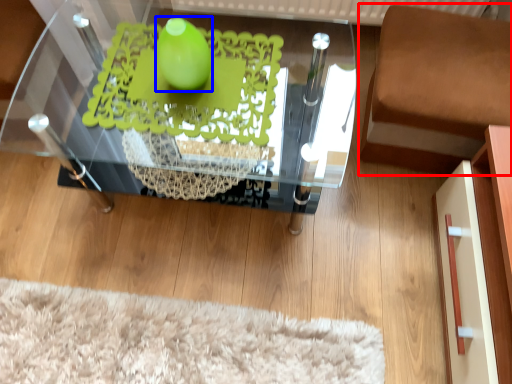
Question: Which of the following is the farthest to the observer, furniture (highlighted by a red box) or lime (highlighted by a blue box)?

Choices:
 (A) furniture
 (B) lime

Answer: (A)